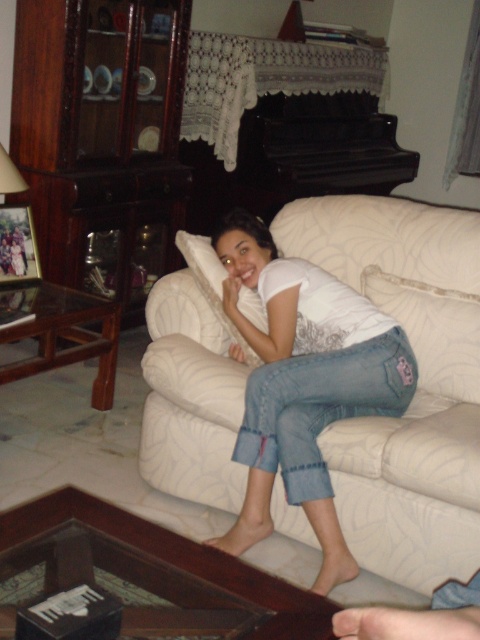
Question: Does white fabric pillow at lower center appear under matte white lampshade at left?

Choices:
 (A) no
 (B) yes

Answer: (B)

Question: Among these objects, which one is farthest from the camera?

Choices:
 (A) matte white lampshade at left
 (B) white fabric pillow at lower center
 (C) white soft pillow at center

Answer: (A)

Question: Which point is farther from the camera taking this photo?

Choices:
 (A) (194, 236)
 (B) (195, 300)

Answer: (A)

Question: Is white fabric couch at center bigger than matte white lampshade at left?

Choices:
 (A) no
 (B) yes

Answer: (B)

Question: Estimate the real-world distances between objects in this image. Which object is closer to the white soft pillow at center?

Choices:
 (A) white fabric pillow at lower center
 (B) white fabric couch at center
 (C) matte white lampshade at left

Answer: (B)

Question: Is white fabric pillow at lower center wider than white soft pillow at center?

Choices:
 (A) no
 (B) yes

Answer: (B)